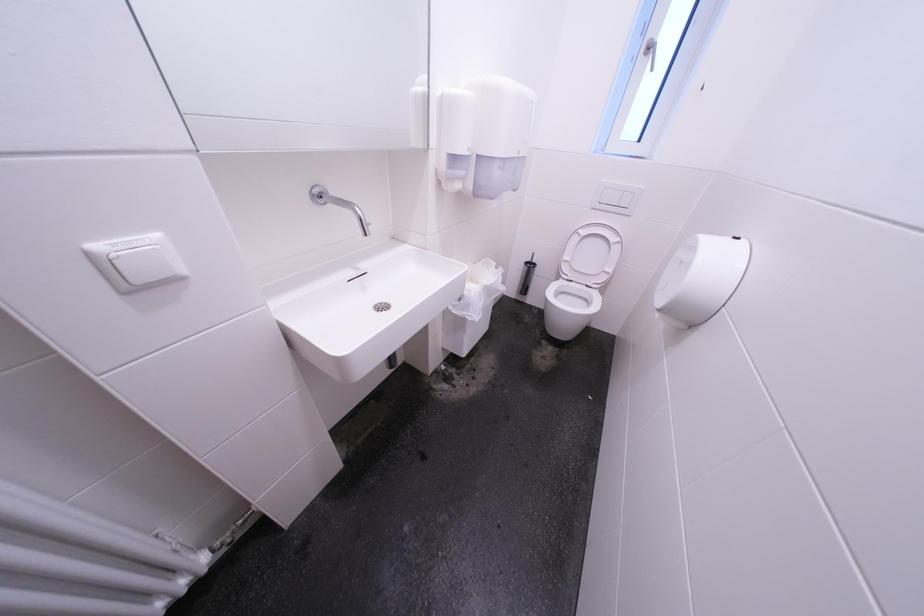
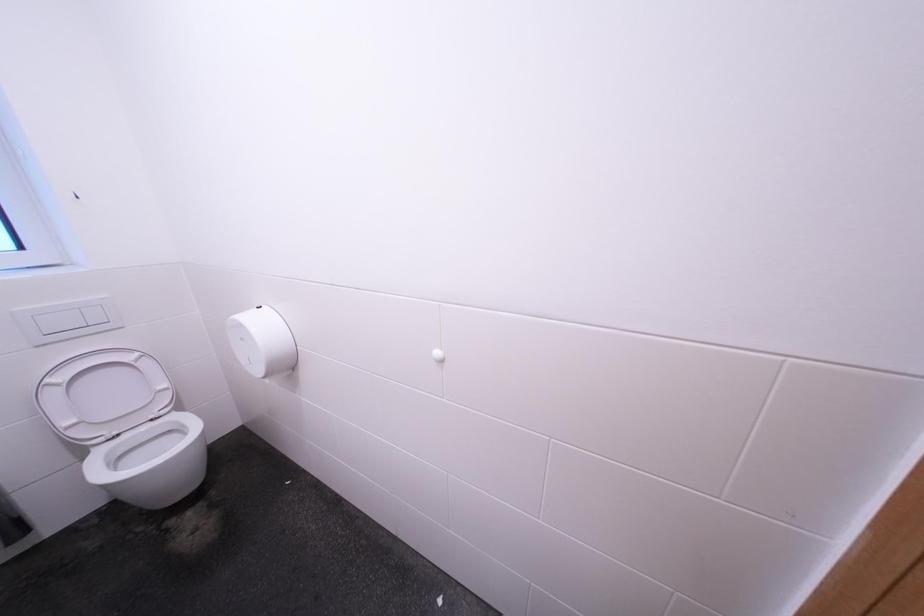
The first image is from the beginning of the video and the second image is from the end. How did the camera likely rotate when shooting the video?

The rotation direction of the camera is right-down.